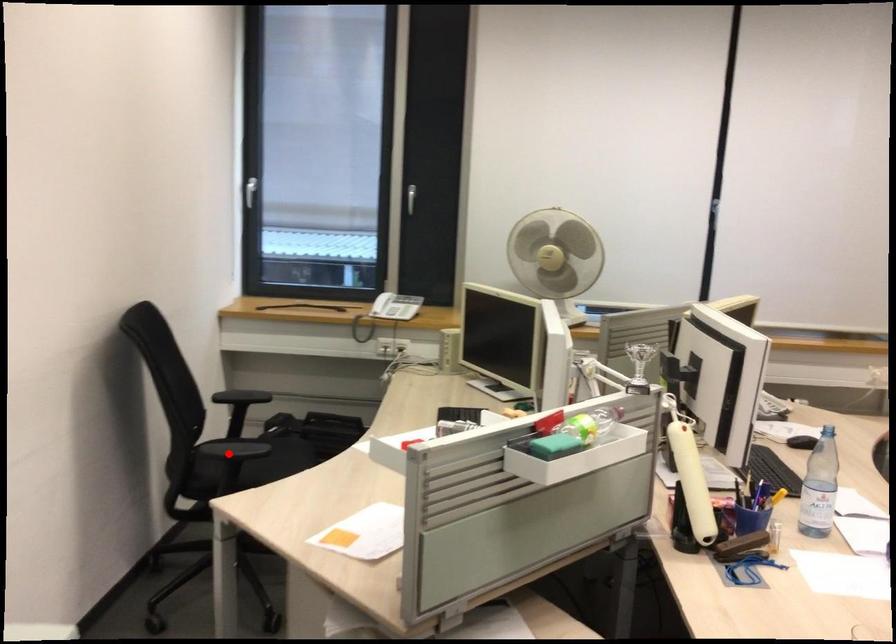
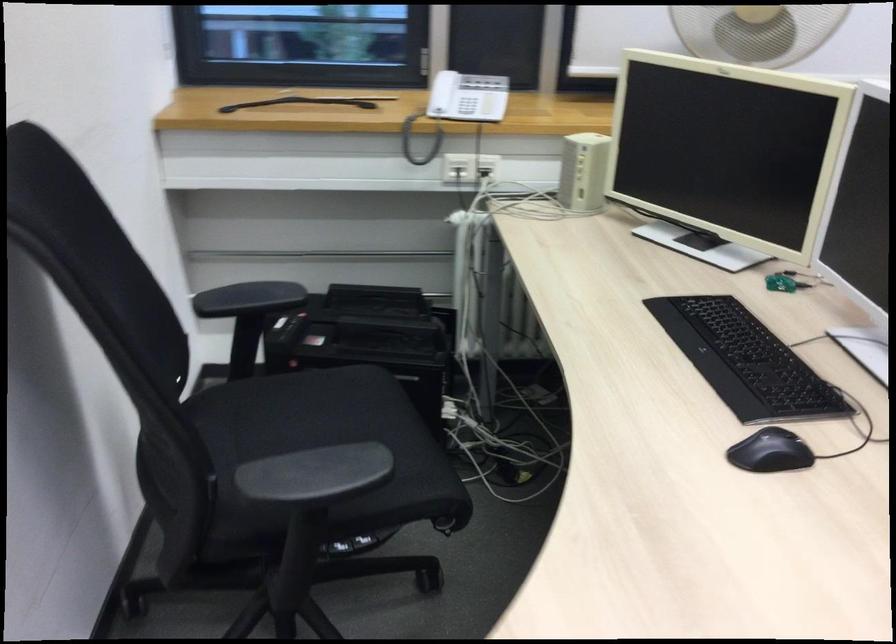
Question: I am providing you with two images of the same scene from different viewpoints. A red point is shown in image1. For the corresponding object point in image2, is it positioned nearer or farther from the camera?

Choices:
 (A) Nearer
 (B) Farther

Answer: (A)